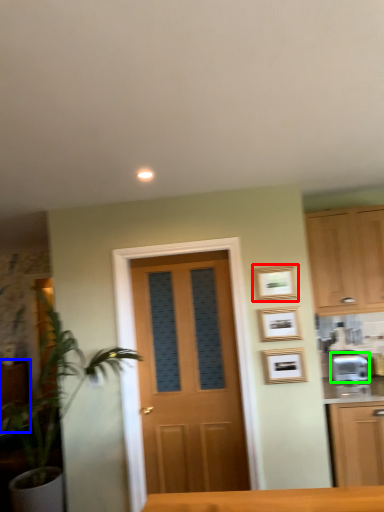
Question: Which is nearer to the picture frame (highlighted by a red box)? cabinetry (highlighted by a blue box) or appliance (highlighted by a green box).

Choices:
 (A) cabinetry
 (B) appliance

Answer: (B)